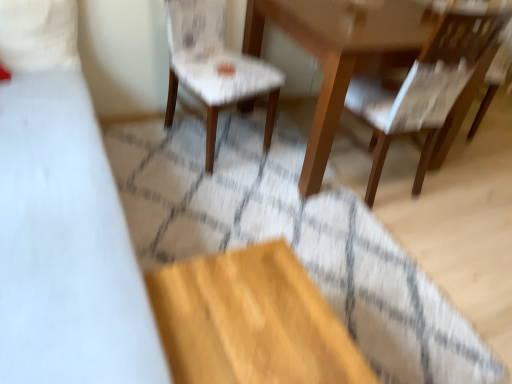
Question: Can you confirm if wooden table at center is thinner than white fabric chair at center, acting as the second chair starting from the right?

Choices:
 (A) yes
 (B) no

Answer: (B)

Question: Is wooden table at center to the right of white fabric chair at center, which is the first chair from left to right, from the viewer's perspective?

Choices:
 (A) yes
 (B) no

Answer: (A)

Question: Can you confirm if wooden table at center is taller than white fabric chair at center, acting as the second chair starting from the right?

Choices:
 (A) yes
 (B) no

Answer: (B)

Question: Is white fabric chair at center, acting as the second chair starting from the right, inside wooden table at center?

Choices:
 (A) yes
 (B) no

Answer: (B)

Question: From the image's perspective, is wooden table at center beneath white fabric chair at center, which is the first chair from left to right?

Choices:
 (A) no
 (B) yes

Answer: (B)

Question: Considering their positions, is white fabric chair at center, acting as the second chair starting from the right, located in front of or behind wooden table at center?

Choices:
 (A) front
 (B) behind

Answer: (A)

Question: Looking at their shapes, would you say white fabric chair at center, which is the first chair from left to right, is wider or thinner than wooden table at center?

Choices:
 (A) wide
 (B) thin

Answer: (B)

Question: From the image's perspective, is white fabric chair at center, acting as the second chair starting from the right, above or below wooden table at center?

Choices:
 (A) above
 (B) below

Answer: (A)

Question: In the image, is white fabric chair at center, acting as the second chair starting from the right, on the left side or the right side of wooden table at center?

Choices:
 (A) right
 (B) left

Answer: (B)

Question: Would you say wooden table at center is inside or outside white fabric bed at left?

Choices:
 (A) outside
 (B) inside

Answer: (A)

Question: From the image's perspective, is wooden table at center located above or below white fabric bed at left?

Choices:
 (A) below
 (B) above

Answer: (B)

Question: Is wooden table at center to the left or to the right of white fabric bed at left in the image?

Choices:
 (A) left
 (B) right

Answer: (B)

Question: Considering their positions, is wooden table at center located in front of or behind white fabric bed at left?

Choices:
 (A) behind
 (B) front

Answer: (A)

Question: Is white fabric chair at center, which is the first chair from left to right, bigger or smaller than wooden chair at right, which ranks as the 1th chair in right-to-left order?

Choices:
 (A) small
 (B) big

Answer: (A)

Question: Is point [173, 102] positioned closer to the camera than point [437, 82]?

Choices:
 (A) farther
 (B) closer

Answer: (A)